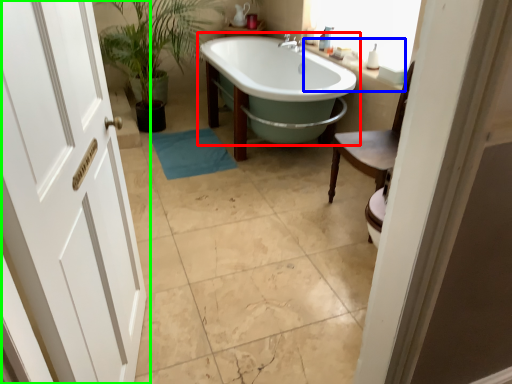
Question: Estimate the real-world distances between objects in this image. Which object is farther from bathtub (highlighted by a red box), counter top (highlighted by a blue box) or door (highlighted by a green box)?

Choices:
 (A) counter top
 (B) door

Answer: (B)